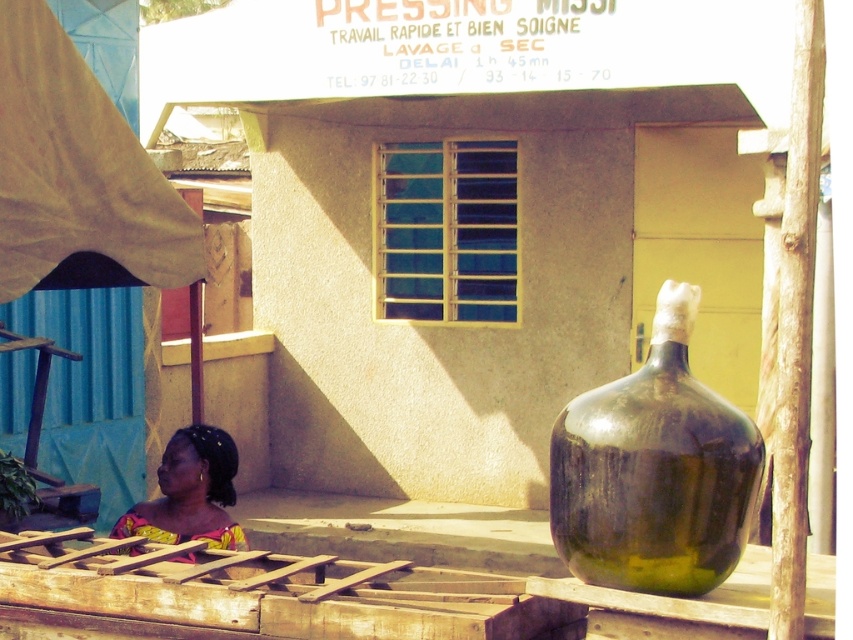
Can you confirm if green glass vase at center is thinner than yellow printed fabric at lower left?

Incorrect, green glass vase at center's width is not less than yellow printed fabric at lower left's.

Who is shorter, green glass vase at center or yellow printed fabric at lower left?

With less height is yellow printed fabric at lower left.

Find the location of `green glass vase at center`. green glass vase at center is located at coordinates (654, 470).

Where is `green glass vase at center`? This screenshot has height=640, width=853. green glass vase at center is located at coordinates (654, 470).